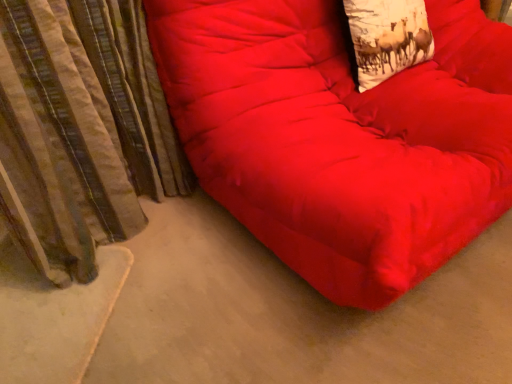
Question: Is matte red beanbag at center turned away from striped fabric curtain at left?

Choices:
 (A) no
 (B) yes

Answer: (A)

Question: Is matte red beanbag at center bigger than striped fabric curtain at left?

Choices:
 (A) yes
 (B) no

Answer: (A)

Question: Is the position of matte red beanbag at center more distant than that of striped fabric curtain at left?

Choices:
 (A) yes
 (B) no

Answer: (B)

Question: From the image's perspective, does matte red beanbag at center appear lower than striped fabric curtain at left?

Choices:
 (A) no
 (B) yes

Answer: (A)

Question: Does matte red beanbag at center have a lesser height compared to striped fabric curtain at left?

Choices:
 (A) yes
 (B) no

Answer: (B)

Question: From a real-world perspective, relative to matte red beanbag at center, is white cotton throw pillow at upper right vertically above or below?

Choices:
 (A) below
 (B) above

Answer: (B)

Question: Is white cotton throw pillow at upper right in front of or behind matte red beanbag at center in the image?

Choices:
 (A) front
 (B) behind

Answer: (B)

Question: Do you think white cotton throw pillow at upper right is within matte red beanbag at center, or outside of it?

Choices:
 (A) inside
 (B) outside

Answer: (A)

Question: From the image's perspective, is white cotton throw pillow at upper right located above or below matte red beanbag at center?

Choices:
 (A) above
 (B) below

Answer: (A)

Question: Do you think white cotton throw pillow at upper right is within striped fabric curtain at left, or outside of it?

Choices:
 (A) outside
 (B) inside

Answer: (A)

Question: In the image, is white cotton throw pillow at upper right on the left side or the right side of striped fabric curtain at left?

Choices:
 (A) right
 (B) left

Answer: (A)

Question: In the image, is white cotton throw pillow at upper right positioned in front of or behind striped fabric curtain at left?

Choices:
 (A) front
 (B) behind

Answer: (B)

Question: Looking at the image, does white cotton throw pillow at upper right seem bigger or smaller compared to striped fabric curtain at left?

Choices:
 (A) big
 (B) small

Answer: (B)

Question: From a real-world perspective, is matte red beanbag at center physically located above or below striped fabric curtain at left?

Choices:
 (A) below
 (B) above

Answer: (B)

Question: Is matte red beanbag at center wider or thinner than striped fabric curtain at left?

Choices:
 (A) wide
 (B) thin

Answer: (A)